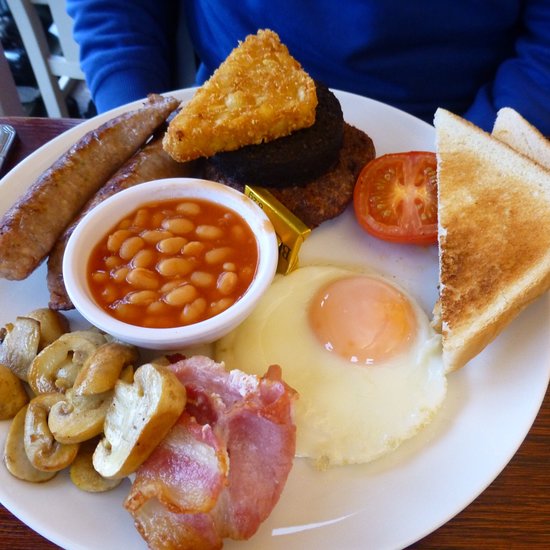
You are a GUI agent. You are given a task and a screenshot of the screen. Output one action in this format:
    pyautogui.click(x=<x>, y=<y>)
    Task: Click on the plate
    Image resolution: width=550 pixels, height=550 pixels.
    Given the screenshot: What is the action you would take?
    pos(371,508)